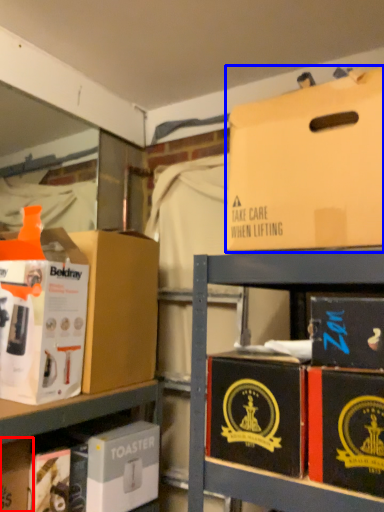
Question: Which object is further to the camera taking this photo, storage box (highlighted by a red box) or box (highlighted by a blue box)?

Choices:
 (A) storage box
 (B) box

Answer: (A)